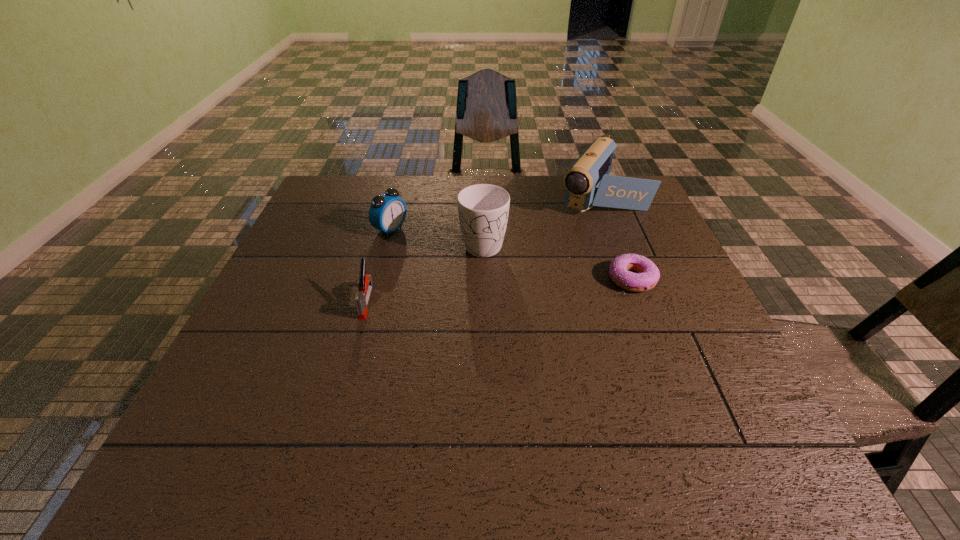
Locate an element on the screen. Image resolution: width=960 pixels, height=540 pixels. vacant spot on the desktop that is between the second shortest object and the shortest object and is positioned on the side of the mug with the handle is located at coordinates (485, 291).

The height and width of the screenshot is (540, 960). What are the coordinates of `free space on the desktop that is between the fourth tallest object and the shortest object and is positioned on the face of the alarm clock` in the screenshot? It's located at (518, 288).

You are a GUI agent. You are given a task and a screenshot of the screen. Output one action in this format:
    pyautogui.click(x=<x>, y=<y>)
    Task: Click on the vacant space on the desktop that is between the second shortest object and the doughnut and is positioned on the side of the camcorder with the flip-out screen
    The image size is (960, 540).
    Given the screenshot: What is the action you would take?
    [539, 287]